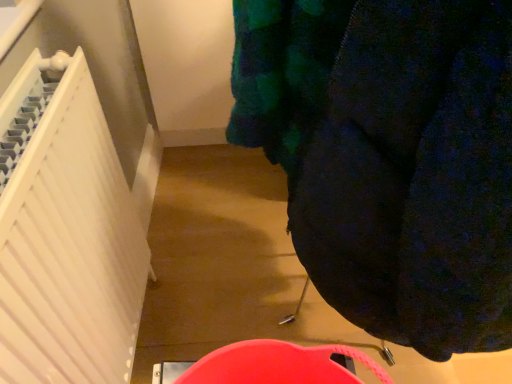
Question: Is white matte radiator at left surrounded by dark blue fabric at center?

Choices:
 (A) yes
 (B) no

Answer: (B)

Question: Considering the relative positions of dark blue fabric at center and white matte radiator at left in the image provided, is dark blue fabric at center to the left of white matte radiator at left from the viewer's perspective?

Choices:
 (A) yes
 (B) no

Answer: (B)

Question: Is dark blue fabric at center thinner than white matte radiator at left?

Choices:
 (A) no
 (B) yes

Answer: (A)

Question: Would you say dark blue fabric at center is a long distance from white matte radiator at left?

Choices:
 (A) no
 (B) yes

Answer: (A)

Question: Is dark blue fabric at center closer to the viewer compared to white matte radiator at left?

Choices:
 (A) yes
 (B) no

Answer: (A)

Question: Can you confirm if dark blue fabric at center is wider than white matte radiator at left?

Choices:
 (A) yes
 (B) no

Answer: (A)

Question: Is white matte radiator at left to the left of dark blue fabric at center from the viewer's perspective?

Choices:
 (A) no
 (B) yes

Answer: (B)

Question: Is white matte radiator at left oriented towards dark blue fabric at center?

Choices:
 (A) no
 (B) yes

Answer: (B)

Question: Considering the relative sizes of white matte radiator at left and dark blue fabric at center in the image provided, is white matte radiator at left smaller than dark blue fabric at center?

Choices:
 (A) yes
 (B) no

Answer: (A)

Question: From a real-world perspective, is white matte radiator at left beneath dark blue fabric at center?

Choices:
 (A) no
 (B) yes

Answer: (B)

Question: Is white matte radiator at left positioned behind dark blue fabric at center?

Choices:
 (A) no
 (B) yes

Answer: (B)

Question: Would you say white matte radiator at left contains dark blue fabric at center?

Choices:
 (A) no
 (B) yes

Answer: (A)

Question: In terms of width, does dark blue fabric at center look wider or thinner when compared to white matte radiator at left?

Choices:
 (A) wide
 (B) thin

Answer: (A)